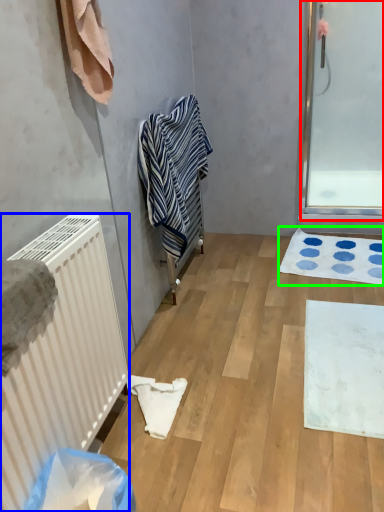
Question: Which object is the farthest from screen door (highlighted by a red box)? Choose among these: radiator (highlighted by a blue box) or bath mat (highlighted by a green box).

Choices:
 (A) radiator
 (B) bath mat

Answer: (A)